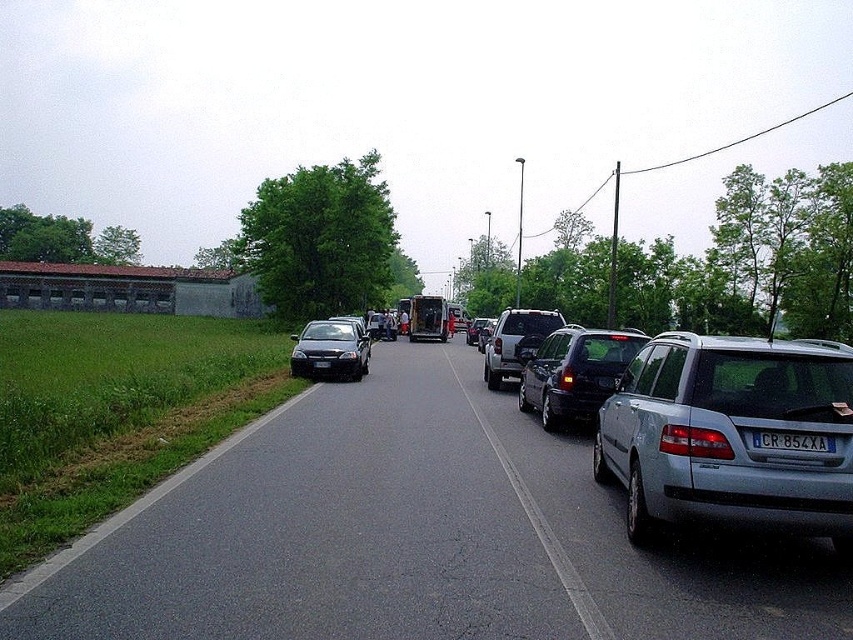
Question: Does shiny black sedan at center-right come in front of satin black car at center?

Choices:
 (A) no
 (B) yes

Answer: (A)

Question: Does shiny black sedan at center-right have a smaller size compared to satin black sedan at center?

Choices:
 (A) yes
 (B) no

Answer: (B)

Question: Can you confirm if satin silver suv at center is positioned to the right of black plastic license plate at center?

Choices:
 (A) no
 (B) yes

Answer: (A)

Question: Which object is positioned closest to the shiny black sedan at center-right?

Choices:
 (A) black plastic license plate at center
 (B) satin silver suv at center
 (C) silver metallic suv at center
 (D) silver metallic station wagon at right

Answer: (B)

Question: Estimate the real-world distances between objects in this image. Which object is farther from the silver metallic suv at center?

Choices:
 (A) satin silver suv at center
 (B) black plastic license plate at center
 (C) shiny black sedan at center-right
 (D) satin black car at center

Answer: (B)

Question: Which object is farther from the camera taking this photo?

Choices:
 (A) silver metallic station wagon at right
 (B) satin silver suv at center
 (C) shiny black sedan at center-right

Answer: (B)